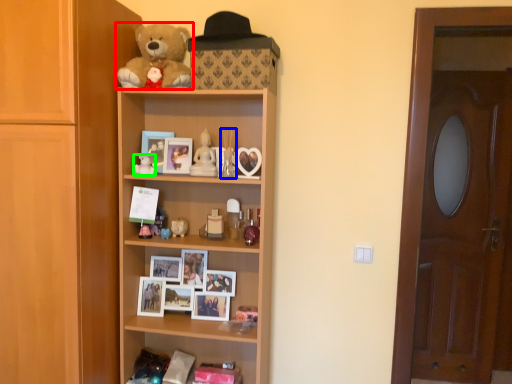
Question: Estimate the real-world distances between objects in this image. Which object is closer to teddy bear (highlighted by a red box), toy (highlighted by a blue box) or toy (highlighted by a green box)?

Choices:
 (A) toy
 (B) toy

Answer: (A)